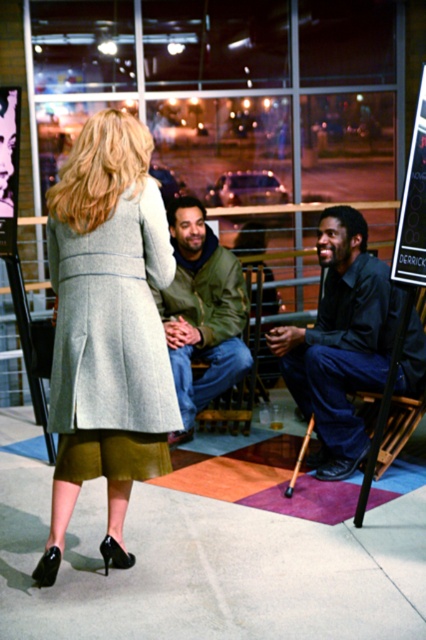
Between point (350, 371) and point (233, 300), which one is positioned in front?

Point (350, 371) is in front.

Can you confirm if dark blue jeans at lower right is positioned below green matte jacket at center?

Yes, dark blue jeans at lower right is below green matte jacket at center.

Describe the element at coordinates (340, 340) in the screenshot. I see `dark blue jeans at lower right` at that location.

I want to click on dark blue jeans at lower right, so click(x=340, y=340).

Which is below, light gray wool coat at center or green matte jacket at center?

Positioned lower is green matte jacket at center.

Is light gray wool coat at center thinner than green matte jacket at center?

Indeed, light gray wool coat at center has a lesser width compared to green matte jacket at center.

This screenshot has width=426, height=640. I want to click on light gray wool coat at center, so click(x=112, y=321).

Can you confirm if matte gray coat at center is bigger than light gray wool coat at center?

Correct, matte gray coat at center is larger in size than light gray wool coat at center.

Is point (51, 220) in front of point (132, 324)?

No, (51, 220) is behind (132, 324).

This screenshot has height=640, width=426. I want to click on matte gray coat at center, so click(x=108, y=328).